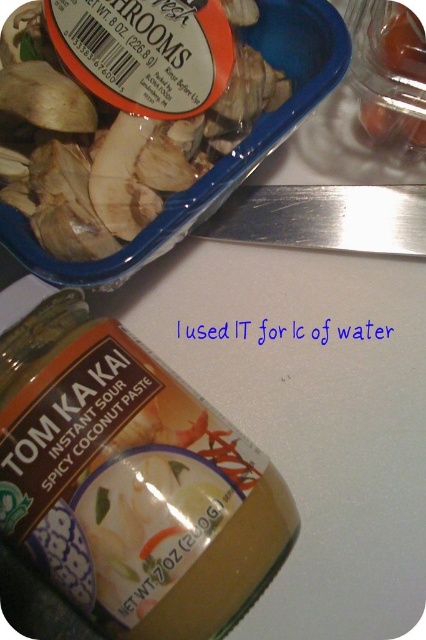
Based on the photo, you are a chef preparing a dish and need to access both the white sliced mushrooms at upper left and the translucent plastic container at upper right. Which item would you need to move first to reach the other?

The white sliced mushrooms at upper left is in front of the translucent plastic container at upper right, so you would need to move the white sliced mushrooms at upper left first to access the container behind it.

You are organizing the items on the kitchen countertop. You need to place a new spice jar that is 10 cm wide. Which item, the white sliced mushrooms at upper left or the translucent plastic container at upper right, would allow more space for the spice jar next to it?

The white sliced mushrooms at upper left has a larger width than the translucent plastic container at upper right, so placing the spice jar next to the translucent plastic container at upper right would leave more space for the spice jar since it is narrower.